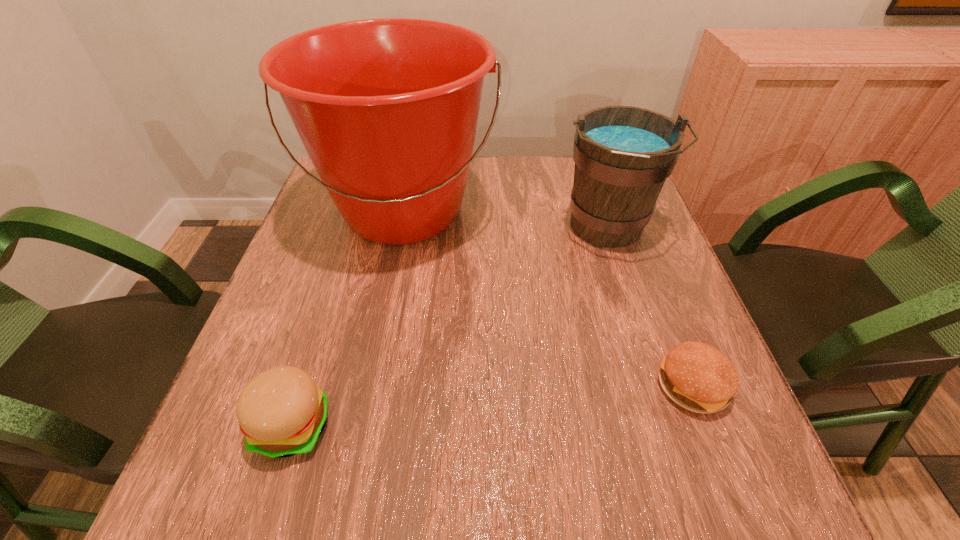
Where is `bucket`? bucket is located at coordinates (387, 109).

In order to click on the third shortest object in this screenshot , I will do `click(623, 155)`.

Identify the location of the taller hamburger. (282, 412).

The height and width of the screenshot is (540, 960). In order to click on the third tallest object in this screenshot , I will do `click(282, 412)`.

This screenshot has width=960, height=540. In order to click on the shortest object in this screenshot , I will do `click(696, 376)`.

This screenshot has height=540, width=960. Find the location of `the shorter hamburger`. the shorter hamburger is located at coordinates (696, 376).

Image resolution: width=960 pixels, height=540 pixels. I want to click on free region located with the handle attached to the rim of the bucket, so 379,331.

I want to click on free region located with a handle on the side of the second tallest object, so click(x=668, y=417).

Image resolution: width=960 pixels, height=540 pixels. Identify the location of vacant space located 0.060m on the front of the third tallest object. (267, 507).

In order to click on vacant region located on the left of the shortest object in this screenshot , I will do `click(509, 387)`.